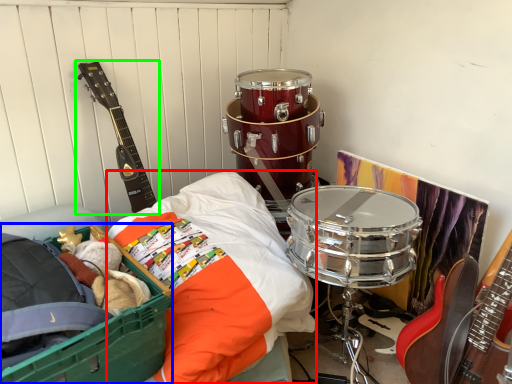
Question: Considering the real-world distances, which object is closest to sheet (highlighted by a red box)? storage box (highlighted by a blue box) or guitar (highlighted by a green box).

Choices:
 (A) storage box
 (B) guitar

Answer: (A)